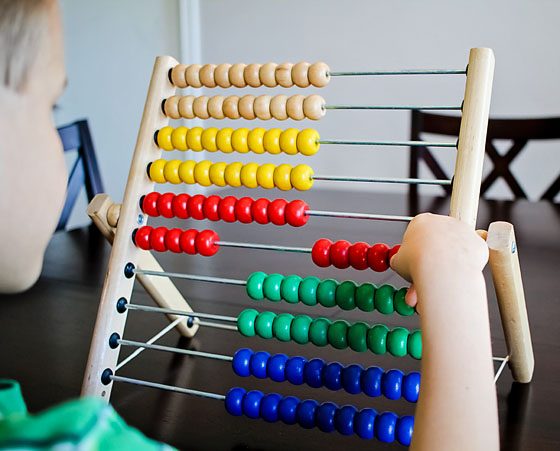
The height and width of the screenshot is (451, 560). Identify the location of rods that beads are on. (344, 73), (345, 106), (340, 139), (338, 176), (316, 211), (270, 245), (223, 277), (212, 314), (200, 352), (189, 389).